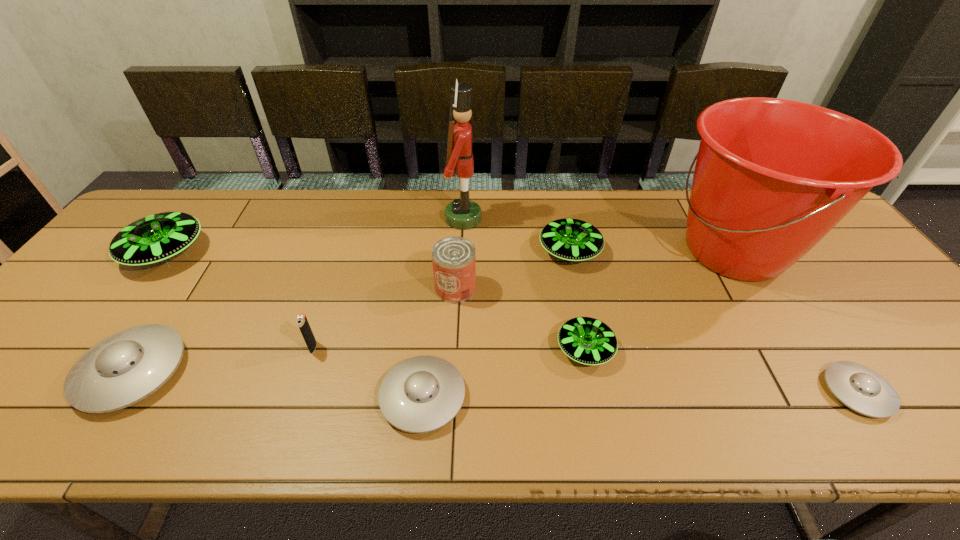
The height and width of the screenshot is (540, 960). I want to click on free spot between the second gray saucer from right to left and the tallest saucer, so click(295, 325).

You are a GUI agent. You are given a task and a screenshot of the screen. Output one action in this format:
    pyautogui.click(x=<x>, y=<y>)
    Task: Click on the vacant space that's between the rightmost gray saucer and the can
    Image resolution: width=960 pixels, height=540 pixels.
    Given the screenshot: What is the action you would take?
    pyautogui.click(x=657, y=340)

Identify the location of free space between the rightmost gray saucer and the igniter. (586, 369).

Identify the location of vacant area that lies between the tallest object and the smallest green saucer. The height and width of the screenshot is (540, 960). (524, 284).

This screenshot has height=540, width=960. Identify the location of vacant point located between the third saucer from left to right and the smallest green saucer. (504, 373).

Find the location of `vacant space that is in between the fifth shortest saucer and the second smallest gray saucer`. vacant space that is in between the fifth shortest saucer and the second smallest gray saucer is located at coordinates (496, 324).

Where is `free space between the igniter and the smallest green saucer`? The image size is (960, 540). free space between the igniter and the smallest green saucer is located at coordinates (449, 348).

I want to click on free space between the black igniter and the leftmost gray saucer, so click(223, 359).

Locate an element on the screen. object identified as the eighth closest to the third object from left to right is located at coordinates (773, 176).

Identify which object is the ninth nearest to the second tallest object. Please provide its 2D coordinates. Your answer should be formatted as a tuple, i.e. [(x, y)], where the tuple contains the x and y coordinates of a point satisfying the conditions above.

[(156, 238)]